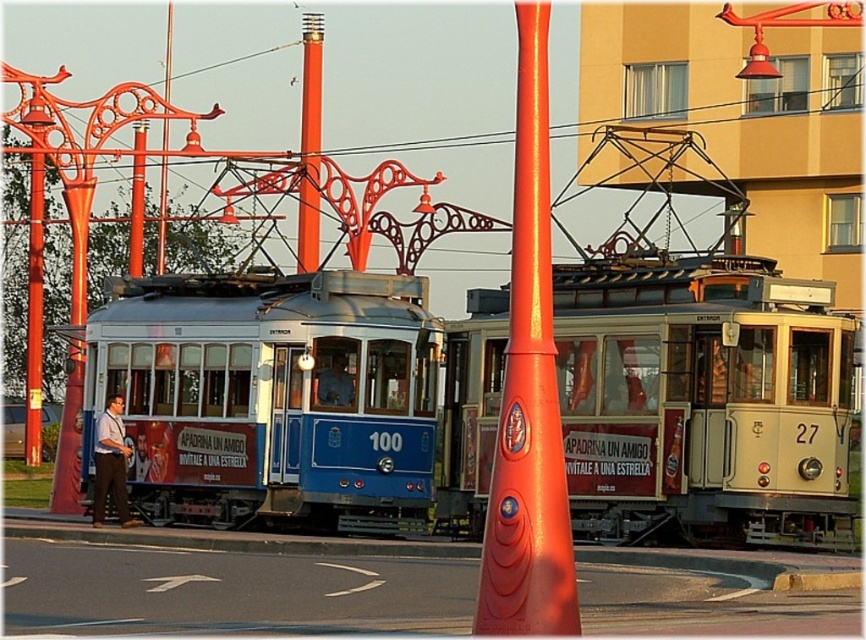
Question: Can you confirm if blue polished metal tram at center is wider than metallic pole at center?

Choices:
 (A) no
 (B) yes

Answer: (A)

Question: Which object is farther from the camera taking this photo?

Choices:
 (A) glossy orange pole at center
 (B) metallic red pole at center
 (C) blue polished metal tram at center

Answer: (B)

Question: Which object appears farthest from the camera in this image?

Choices:
 (A) blue polished metal tram at center
 (B) smooth orange pole at center
 (C) metallic red pole at center
 (D) glossy orange pole at center

Answer: (B)

Question: Does matte cream cable car at center appear under glossy orange pole at center?

Choices:
 (A) no
 (B) yes

Answer: (A)

Question: Is matte cream cable car at center above blue polished metal tram at center?

Choices:
 (A) no
 (B) yes

Answer: (A)

Question: Which of the following is the farthest from the observer?

Choices:
 (A) (554, 584)
 (B) (314, 268)
 (C) (212, 452)
 (D) (166, 132)

Answer: (D)